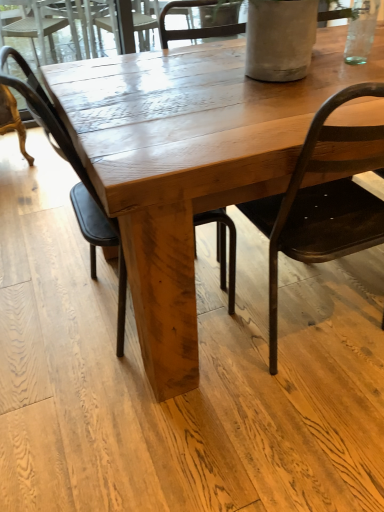
Question: Considering the positions of matte black chair at center, which is counted as the 2th chair, starting from the right, and wooden table at center in the image, is matte black chair at center, which is counted as the 2th chair, starting from the right, bigger or smaller than wooden table at center?

Choices:
 (A) big
 (B) small

Answer: (B)

Question: Is point (67, 158) positioned closer to the camera than point (195, 178)?

Choices:
 (A) farther
 (B) closer

Answer: (A)

Question: Which is nearer to the matte black chair at center, the first chair from the left?

Choices:
 (A) matte black chair at right, acting as the 2th chair starting from the left
 (B) wooden table at center

Answer: (B)

Question: Which object is positioned closest to the wooden table at center?

Choices:
 (A) matte black chair at right, acting as the 2th chair starting from the left
 (B) matte black chair at center, the first chair from the left

Answer: (A)